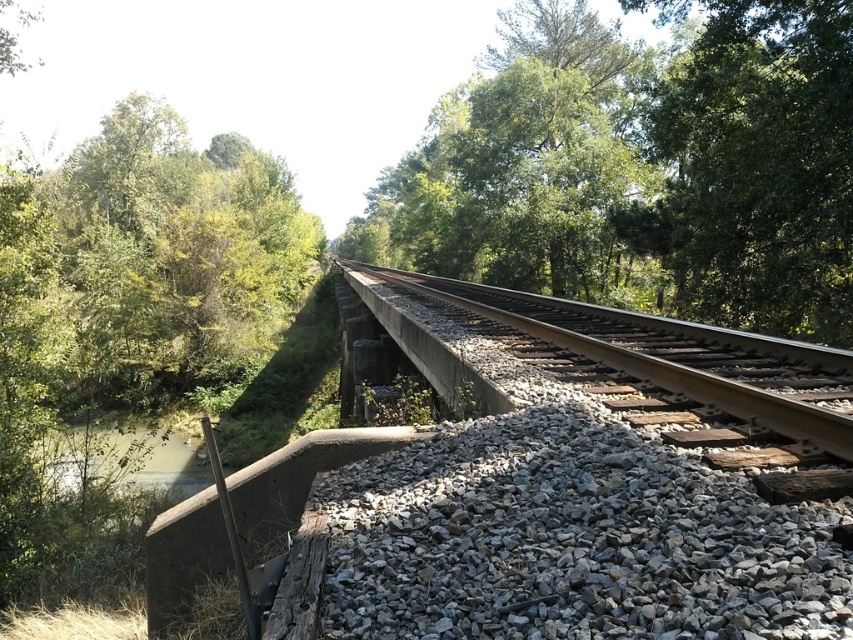
Between green leafy tree at center and muddy water at lower left, which one has more height?

Standing taller between the two is green leafy tree at center.

Which is behind, point (845, 337) or point (70, 483)?

Positioned behind is point (70, 483).

This screenshot has height=640, width=853. What are the coordinates of `green leafy tree at center` in the screenshot? It's located at pos(643,166).

Which is more to the right, green leafy tree at center or green leafy tree at upper right?

green leafy tree at upper right is more to the right.

Does green leafy tree at center appear over green leafy tree at upper right?

Yes, green leafy tree at center is above green leafy tree at upper right.

The width and height of the screenshot is (853, 640). What do you see at coordinates (643, 166) in the screenshot?
I see `green leafy tree at center` at bounding box center [643, 166].

Identify the location of green leafy tree at center. This screenshot has width=853, height=640. (643, 166).

From the picture: Is green leafy tree at center wider than smooth concrete track at center?

Yes, green leafy tree at center is wider than smooth concrete track at center.

Does green leafy tree at center have a smaller size compared to smooth concrete track at center?

Actually, green leafy tree at center might be larger than smooth concrete track at center.

At what (x,y) coordinates should I click in order to perform the action: click on green leafy tree at center. Please return your answer as a coordinate pair (x, y). The height and width of the screenshot is (640, 853). Looking at the image, I should click on (643, 166).

Find the location of `green leafy tree at center`. green leafy tree at center is located at coordinates (643, 166).